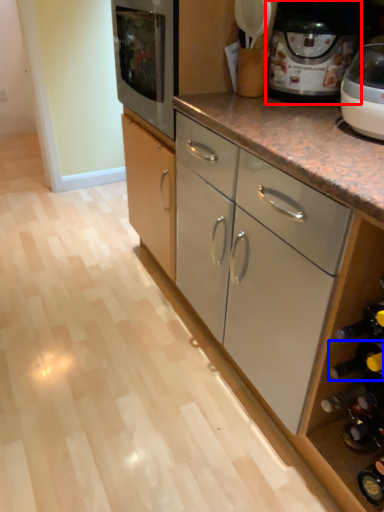
Question: Among these objects, which one is farthest to the camera, home appliance (highlighted by a red box) or wine bottle (highlighted by a blue box)?

Choices:
 (A) home appliance
 (B) wine bottle

Answer: (A)